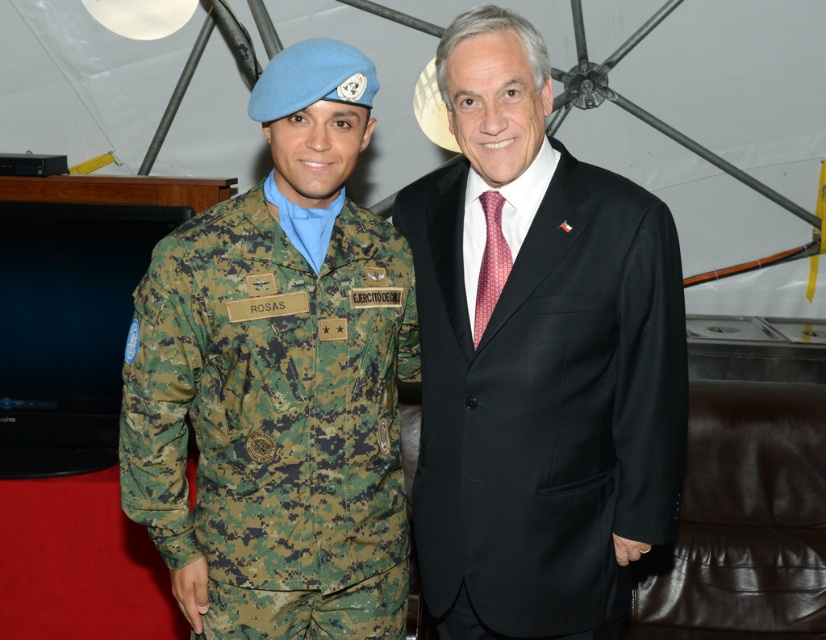
Between camouflagetextured fabric at left and red dotted fabric tie at center, which one has less height?

red dotted fabric tie at center is shorter.

Who is higher up, camouflagetextured fabric at left or red dotted fabric tie at center?

red dotted fabric tie at center

Does point (259, 586) come farther from viewer compared to point (497, 269)?

No.

Locate an element on the screen. The image size is (826, 640). camouflagetextured fabric at left is located at coordinates (274, 419).

Between point (635, 188) and point (501, 230), which one is positioned behind?

The point (501, 230) is behind.

Based on the photo, which is more to the left, black satin suit at center or red dotted fabric tie at center?

red dotted fabric tie at center is more to the left.

Which is in front, point (471, 419) or point (490, 289)?

Point (490, 289)

The image size is (826, 640). In order to click on black satin suit at center in this screenshot , I will do `click(539, 362)`.

Can you confirm if black satin suit at center is wider than camouflagetextured fabric at left?

Correct, the width of black satin suit at center exceeds that of camouflagetextured fabric at left.

Who is more forward, (502, 525) or (160, 525)?

Point (160, 525) is more forward.

Where is `black satin suit at center`? black satin suit at center is located at coordinates (539, 362).

Image resolution: width=826 pixels, height=640 pixels. In order to click on black satin suit at center in this screenshot , I will do `click(539, 362)`.